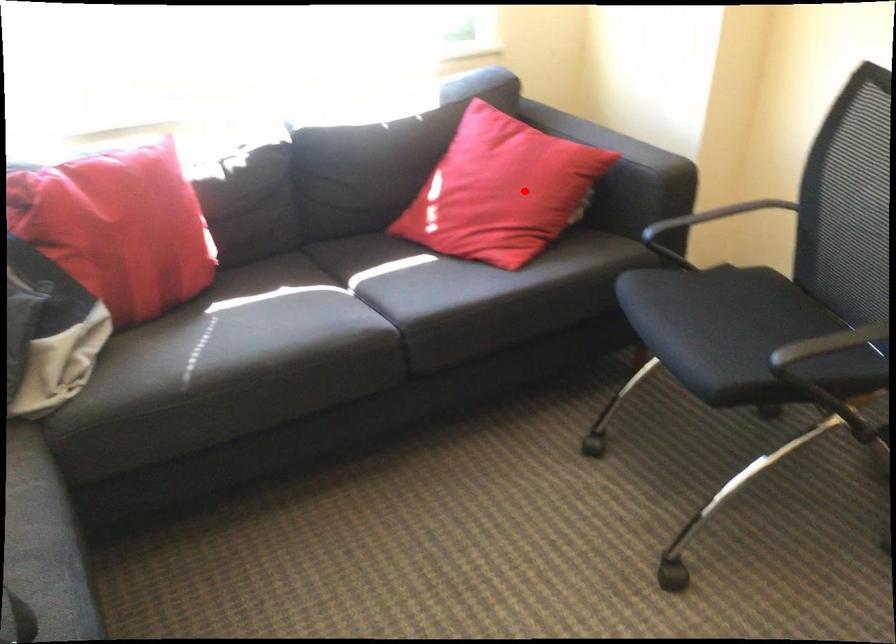
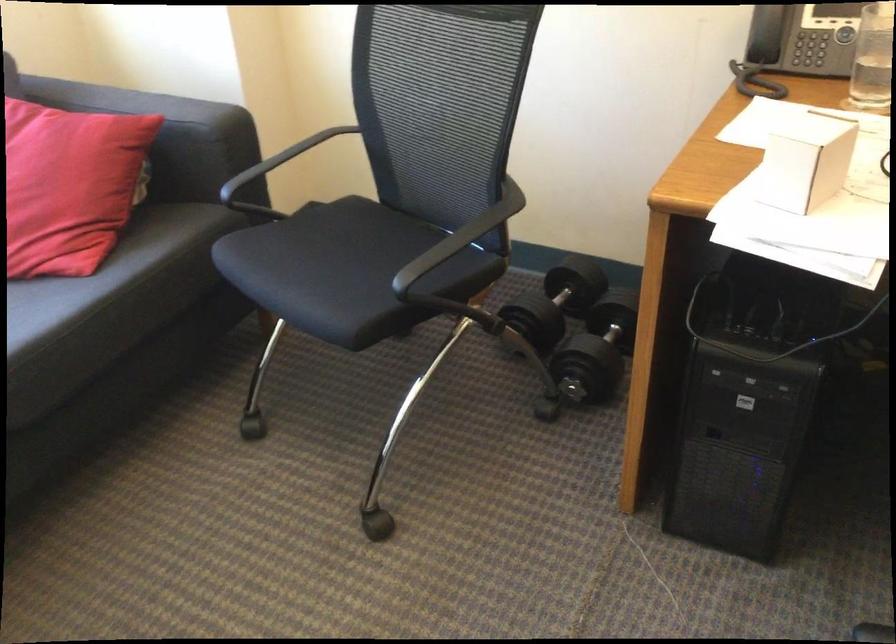
Locate, in the second image, the point that corresponds to the highlighted location in the first image.

(69, 185)